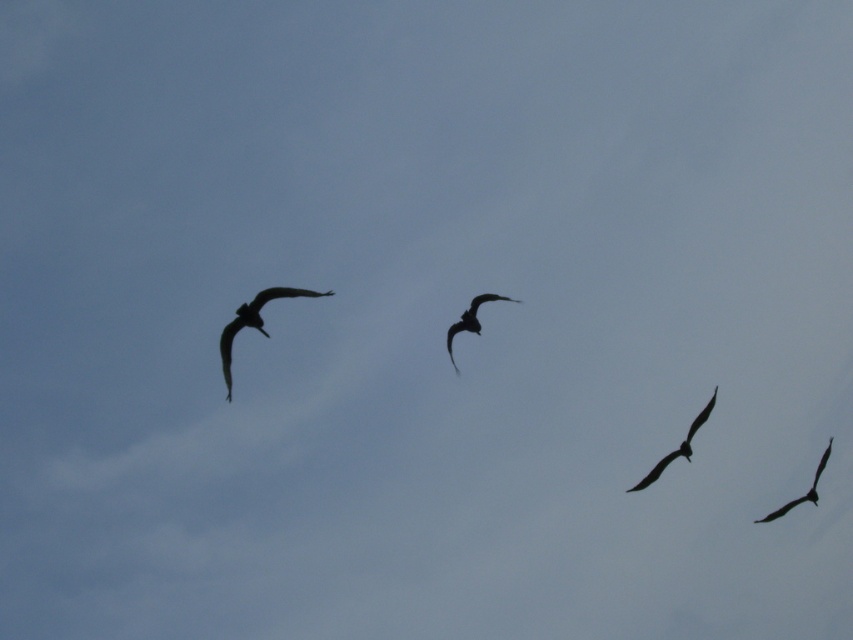
Question: Does black matte bird at lower right appear on the right side of silhouette feathered bird at lower right?

Choices:
 (A) no
 (B) yes

Answer: (A)

Question: Estimate the real-world distances between objects in this image. Which object is farther from the silhouette feathered bird at lower right?

Choices:
 (A) silhouette feathered bird at center
 (B) black matte bird at lower right

Answer: (A)

Question: Considering the relative positions of black matte bird at upper left and silhouette feathered bird at center in the image provided, where is black matte bird at upper left located with respect to silhouette feathered bird at center?

Choices:
 (A) above
 (B) below

Answer: (A)

Question: Among these points, which one is nearest to the camera?

Choices:
 (A) (450, 355)
 (B) (688, 456)

Answer: (A)

Question: Does black matte bird at lower right appear on the left side of silhouette feathered bird at center?

Choices:
 (A) yes
 (B) no

Answer: (B)

Question: Which of the following is the closest to the observer?

Choices:
 (A) silhouette feathered bird at center
 (B) silhouette feathered bird at lower right
 (C) black matte bird at lower right

Answer: (A)